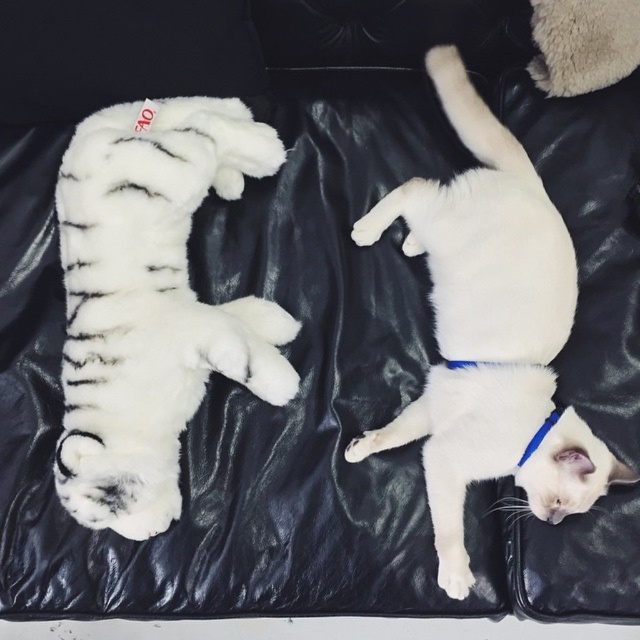
Which is behind, point (244, 163) or point (524, 458)?

Point (244, 163)

Is point (132, 296) closer to camera compared to point (548, 426)?

Yes, point (132, 296) is closer to viewer.

I want to click on white plush toy at left, so click(x=150, y=304).

Which is below, white fur cat at center or blue fabric neckband at lower right?

blue fabric neckband at lower right is lower down.

Identify the location of white fur cat at center. This screenshot has height=640, width=640. (488, 330).

Does white plush toy at left appear over white fur cat at center?

Incorrect, white plush toy at left is not positioned above white fur cat at center.

Who is positioned more to the left, white plush toy at left or white fur cat at center?

white plush toy at left is more to the left.

Find the location of a particular element. The height and width of the screenshot is (640, 640). white plush toy at left is located at coordinates (150, 304).